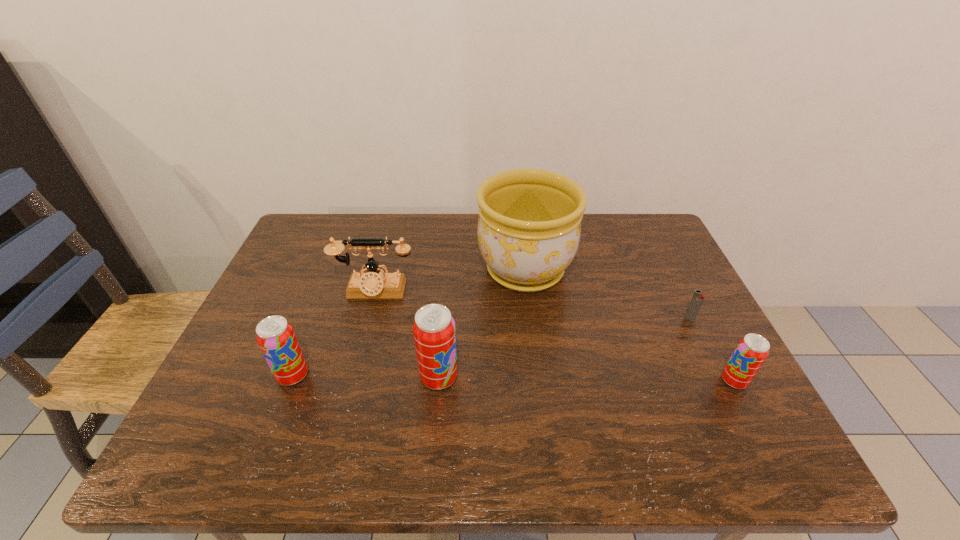
This screenshot has width=960, height=540. Find the location of `soda can object that ranks as the closest to the third object from right to left`. soda can object that ranks as the closest to the third object from right to left is located at coordinates (434, 332).

Identify which soda can is the nearest to the third object from right to left. Please provide its 2D coordinates. Your answer should be formatted as a tuple, i.e. [(x, y)], where the tuple contains the x and y coordinates of a point satisfying the conditions above.

[(434, 332)]

Where is `vacant space that satisfies the following two spatial constraints: 1. on the back side of the shortest object; 2. on the left side of the second soda can from right to left`? vacant space that satisfies the following two spatial constraints: 1. on the back side of the shortest object; 2. on the left side of the second soda can from right to left is located at coordinates (444, 319).

Find the location of a particular element. This screenshot has width=960, height=540. vacant position in the image that satisfies the following two spatial constraints: 1. on the dial of the telephone; 2. on the left side of the tallest soda can is located at coordinates (352, 377).

At what (x,y) coordinates should I click in order to perform the action: click on free space that satisfies the following two spatial constraints: 1. on the dial of the telephone; 2. on the left side of the fourth object from right to left. Please return your answer as a coordinate pair (x, y). Looking at the image, I should click on (352, 377).